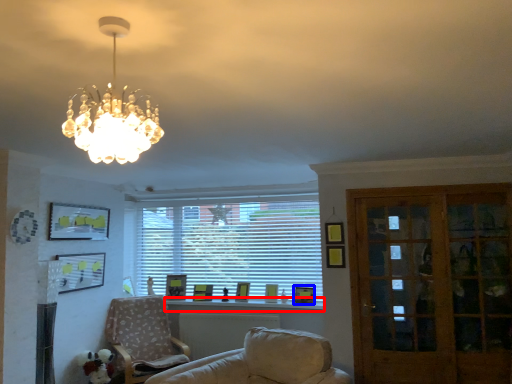
Question: Which point is closer to the camera, window sill (highlighted by a red box) or picture frame (highlighted by a blue box)?

Choices:
 (A) window sill
 (B) picture frame

Answer: (A)